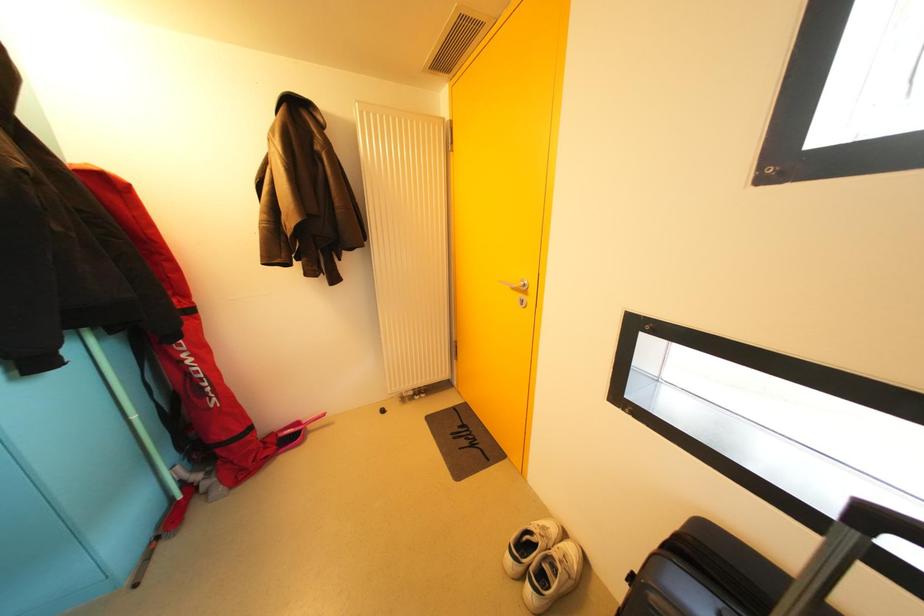
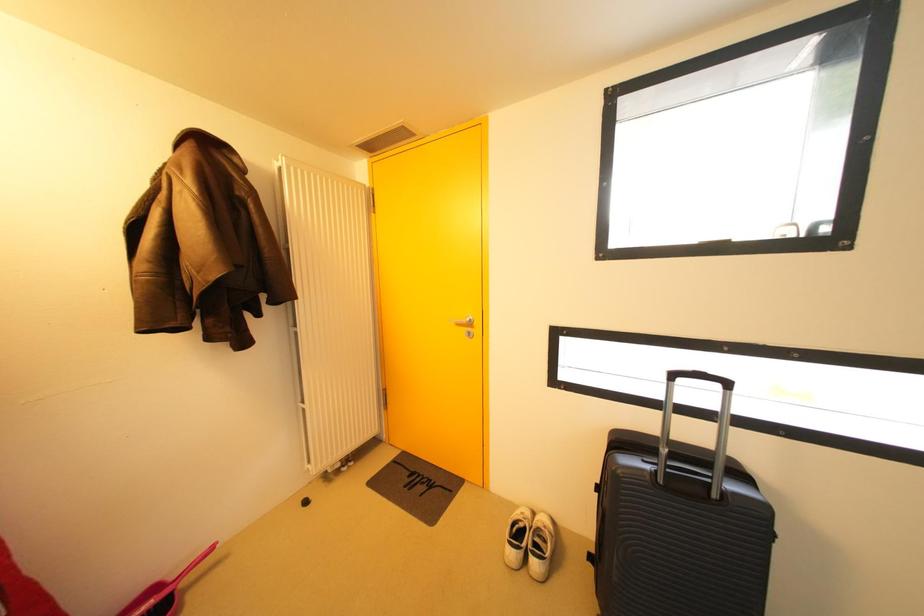
Question: The camera is either moving clockwise (left) or counter-clockwise (right) around the object. The first image is from the beginning of the video and the second image is from the end. Is the camera moving left or right when shooting the video?

Choices:
 (A) Left
 (B) Right

Answer: (A)